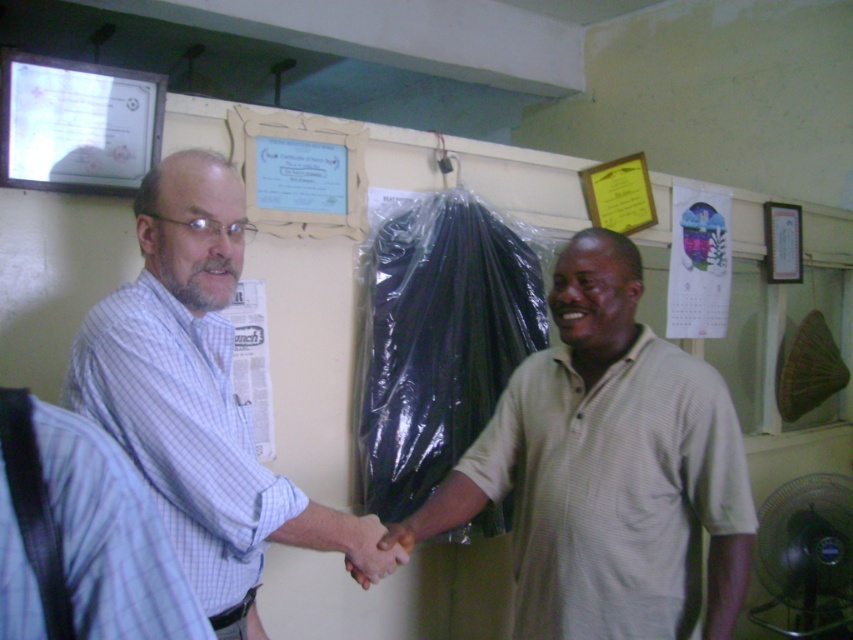
Question: Can you confirm if beige cotton shirt at center is wider than white striped shirt at center?

Choices:
 (A) yes
 (B) no

Answer: (A)

Question: Which object appears farthest from the camera in this image?

Choices:
 (A) beige cotton shirt at center
 (B) white striped shirt at center

Answer: (A)

Question: Among these objects, which one is farthest from the camera?

Choices:
 (A) beige cotton shirt at center
 (B) white striped shirt at center

Answer: (A)

Question: Considering the relative positions of beige cotton shirt at center and white striped shirt at center in the image provided, where is beige cotton shirt at center located with respect to white striped shirt at center?

Choices:
 (A) left
 (B) right

Answer: (B)

Question: Among these points, which one is nearest to the camera?

Choices:
 (A) (572, 531)
 (B) (273, 516)

Answer: (B)

Question: Can you confirm if beige cotton shirt at center is positioned to the right of white striped shirt at center?

Choices:
 (A) yes
 (B) no

Answer: (A)